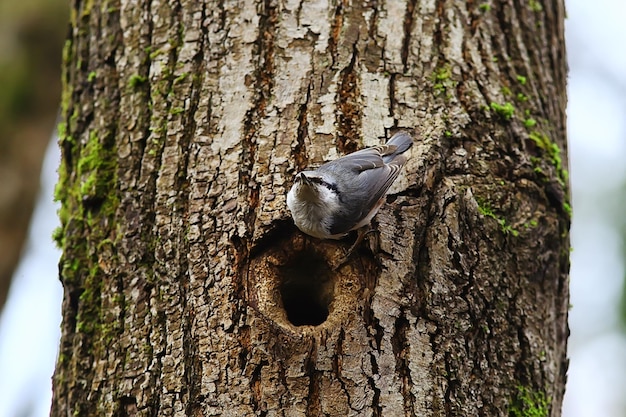
At what (x,y) coordinates should I click in order to perform the action: click on picture. Please return your answer as a coordinate pair (x, y). Looking at the image, I should click on (283, 138).